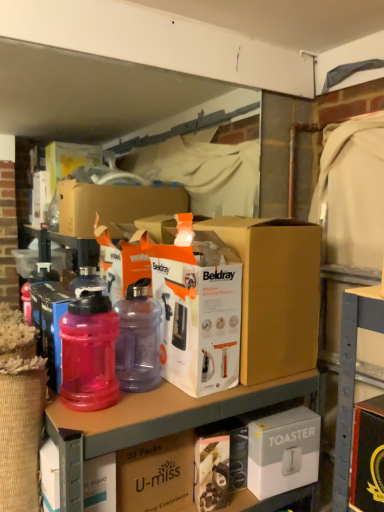
Question: Do you think pink translucent bottle at left, the first bottle viewed from the left, is within purple translucent bottle at center, the first bottle when ordered from right to left, or outside of it?

Choices:
 (A) outside
 (B) inside

Answer: (A)

Question: Relative to purple translucent bottle at center, the second bottle when ordered from left to right, is pink translucent bottle at left, the first bottle viewed from the left, in front or behind?

Choices:
 (A) front
 (B) behind

Answer: (A)

Question: Based on their relative distances, which object is nearer to the transparent plastic bottles at upper center?

Choices:
 (A) pink translucent bottle at left, the first bottle viewed from the left
 (B) white cardboard box at center, placed as the 3th box when sorted from left to right
 (C) white cardboard toaster at lower right, which ranks as the fourth box in left-to-right order
 (D) transparent plastic water bottle at left, acting as the 1th box starting from the left
 (E) purple translucent bottle at center, the first bottle when ordered from right to left

Answer: (A)

Question: Which is nearer to the transparent plastic bottles at upper center?

Choices:
 (A) white cardboard box at center, the second box when ordered from right to left
 (B) purple translucent bottle at center, the second bottle when ordered from left to right
 (C) brown cardboard box at center, the third box from the right
 (D) transparent plastic water bottle at left, the 4th box when ordered from right to left
 (E) pink translucent bottle at left, the first bottle viewed from the left

Answer: (C)